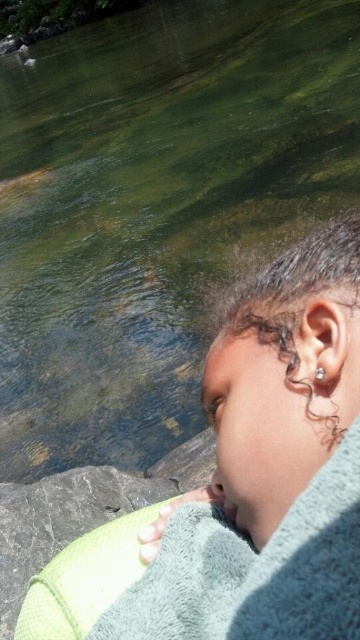
You are a photographer trying to capture the reflection of the green towel at lower right and the dark curly hair at right in the water. Which object will have a larger reflection on the water surface?

The green towel at lower right has a greater height compared to the dark curly hair at right, so its reflection will be larger on the water surface.

You are a photographer trying to capture the reflection on the water surface. You notice the green towel at lower right and the dark curly hair at right. Which object is wider when viewed from above?

The green towel at lower right is wider than the dark curly hair at right.